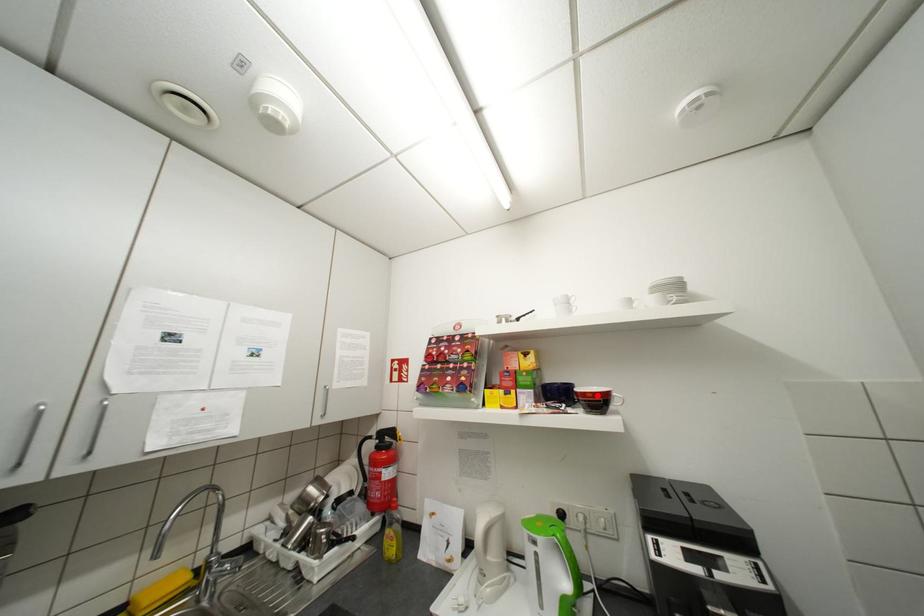
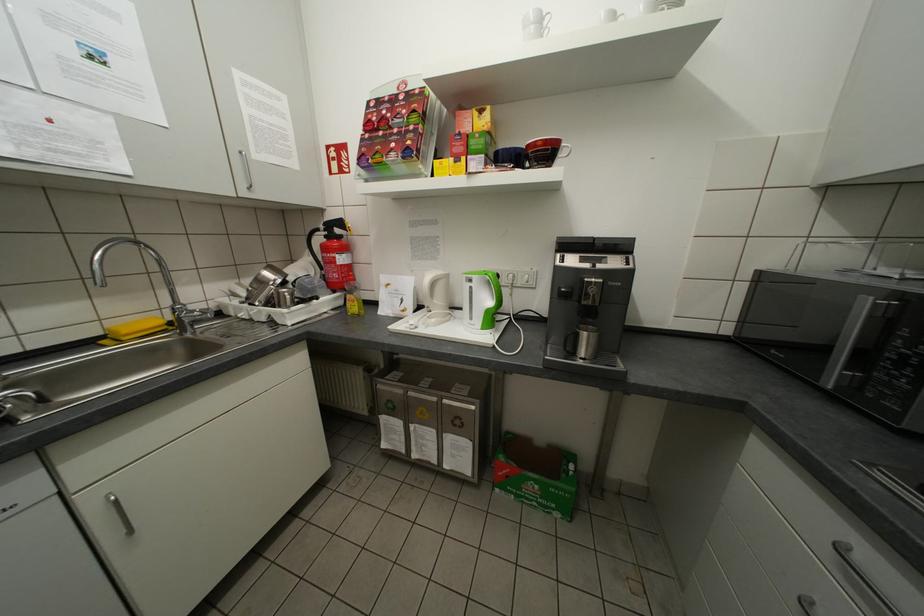
In the second image, find the point that corresponds to the highlighted location in the first image.

(548, 144)